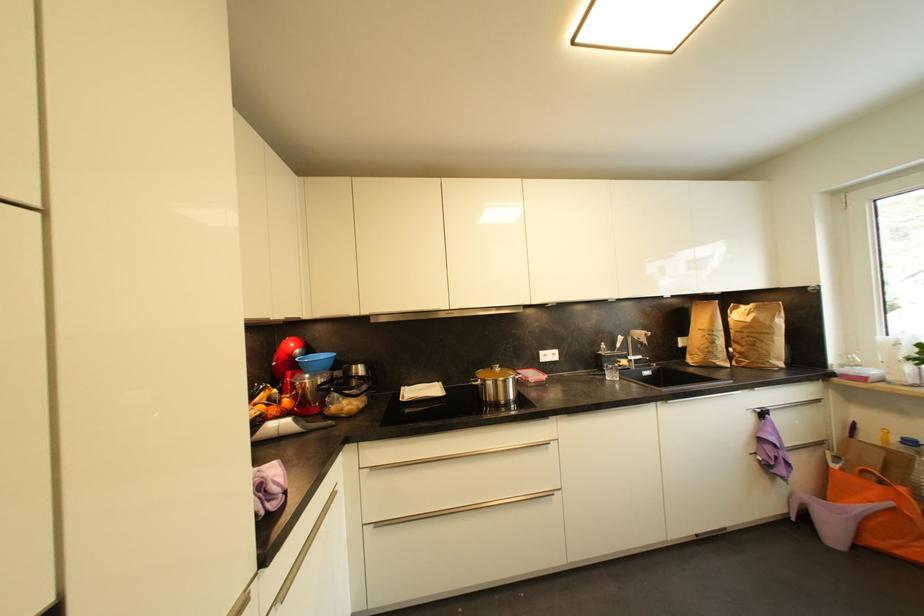
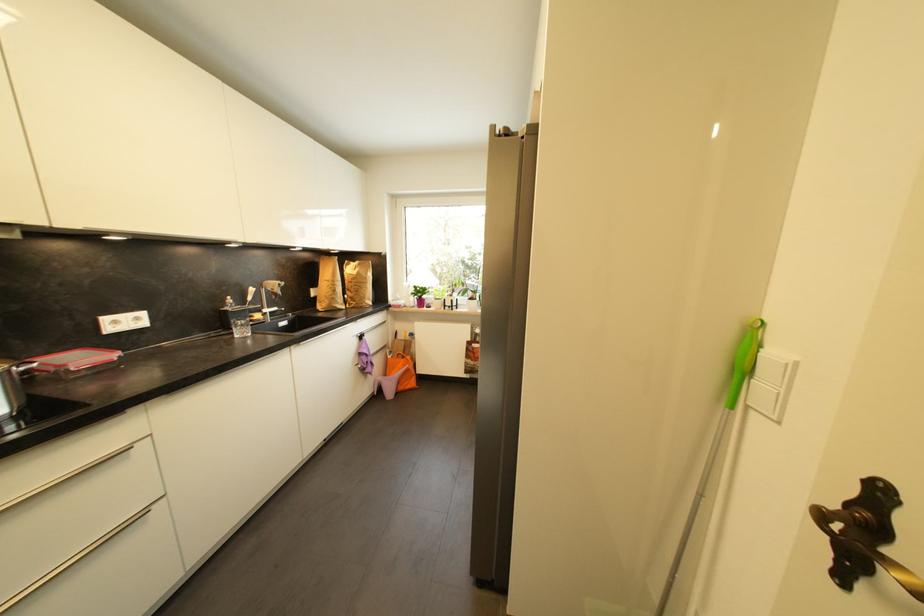
In the second image, find the point that corresponds to (748,330) in the first image.

(358, 281)